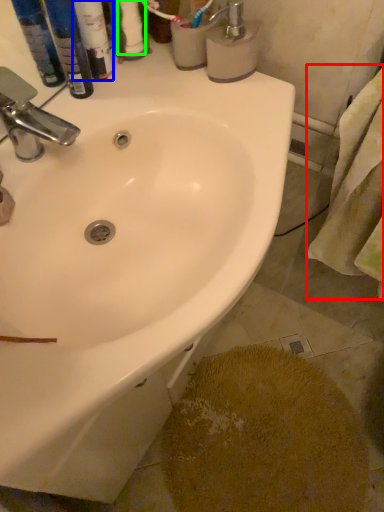
Question: Considering the real-world distances, which object is farthest from bath towel (highlighted by a red box)? toiletry (highlighted by a blue box) or toilet paper (highlighted by a green box)?

Choices:
 (A) toiletry
 (B) toilet paper

Answer: (A)